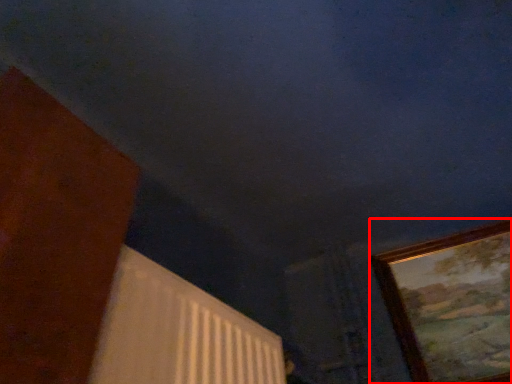
Question: From the image's perspective, what is the correct spatial positioning of picture frame (annotated by the red box) in reference to radiator?

Choices:
 (A) below
 (B) above

Answer: (B)